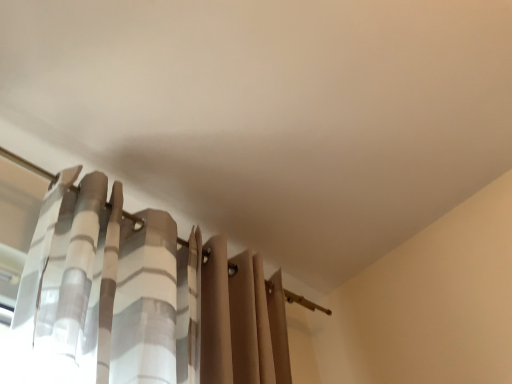
The width and height of the screenshot is (512, 384). Identify the location of white striped fabric curtain at center. 141,298.

What do you see at coordinates (141, 298) in the screenshot?
I see `white striped fabric curtain at center` at bounding box center [141, 298].

Image resolution: width=512 pixels, height=384 pixels. Identify the location of white striped fabric curtain at center. (141, 298).